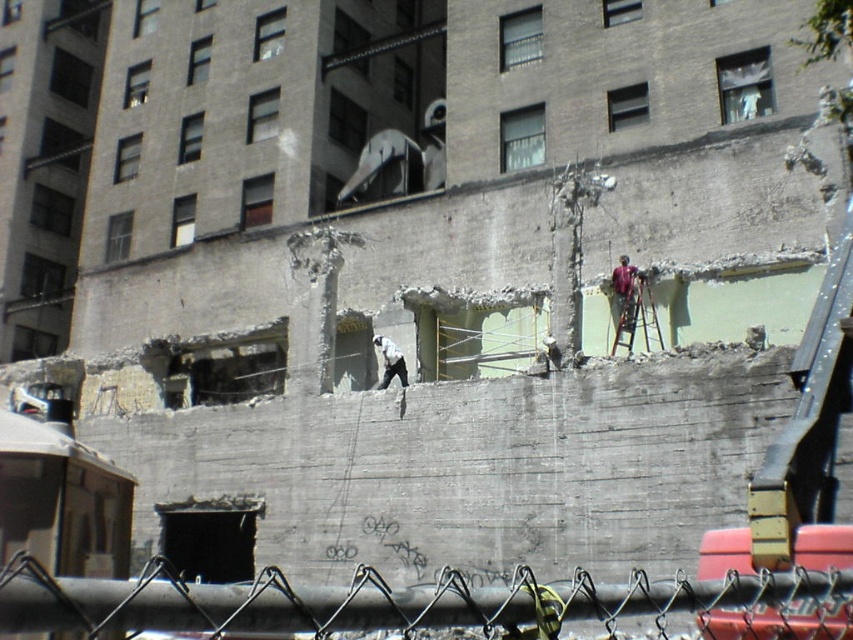
Who is higher up, metallic chain-link fence at lower center or white matte helmet at center?

Positioned higher is white matte helmet at center.

Which of these two, metallic chain-link fence at lower center or white matte helmet at center, stands shorter?

Standing shorter between the two is white matte helmet at center.

Is point (773, 580) positioned after point (386, 349)?

No, (773, 580) is closer to viewer.

Locate an element on the screen. metallic chain-link fence at lower center is located at coordinates (247, 605).